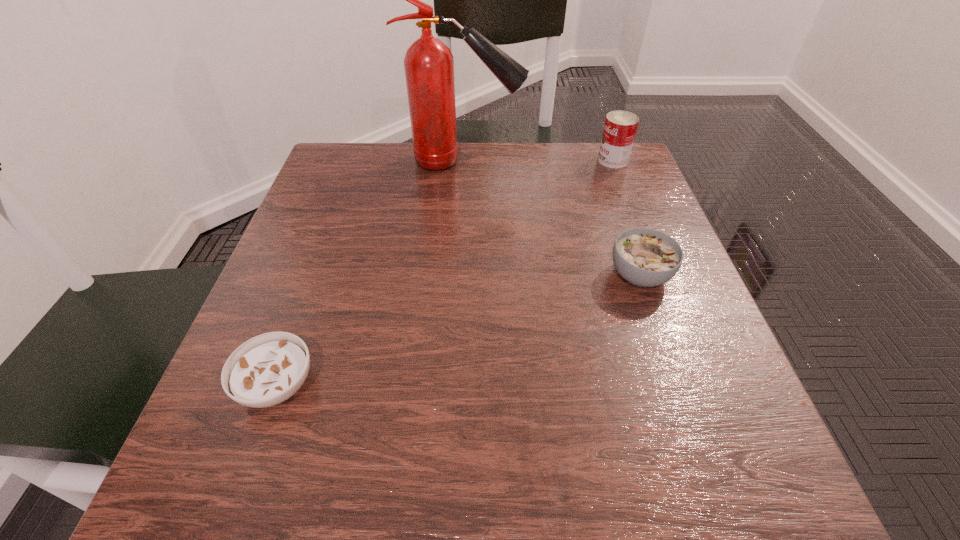
Find the location of a particular element. The height and width of the screenshot is (540, 960). the third object from right to left is located at coordinates (429, 64).

Where is `fire extinguisher`? The height and width of the screenshot is (540, 960). fire extinguisher is located at coordinates (429, 64).

I want to click on can, so click(620, 127).

Locate an element on the screen. the second shortest object is located at coordinates (645, 257).

Find the location of a particular element. This screenshot has height=540, width=960. the third farthest object is located at coordinates (645, 257).

Where is `the nearer soup bowl`? The image size is (960, 540). the nearer soup bowl is located at coordinates (266, 370).

Locate an element on the screen. The width and height of the screenshot is (960, 540). the shorter soup bowl is located at coordinates [x=266, y=370].

Where is `free space located at the nozzle end of the fire extinguisher`? free space located at the nozzle end of the fire extinguisher is located at coordinates (616, 160).

Locate an element on the screen. free spot located 0.370m on the front label of the second tallest object is located at coordinates (447, 160).

This screenshot has width=960, height=540. I want to click on vacant space located 0.180m on the front label of the second tallest object, so click(x=525, y=160).